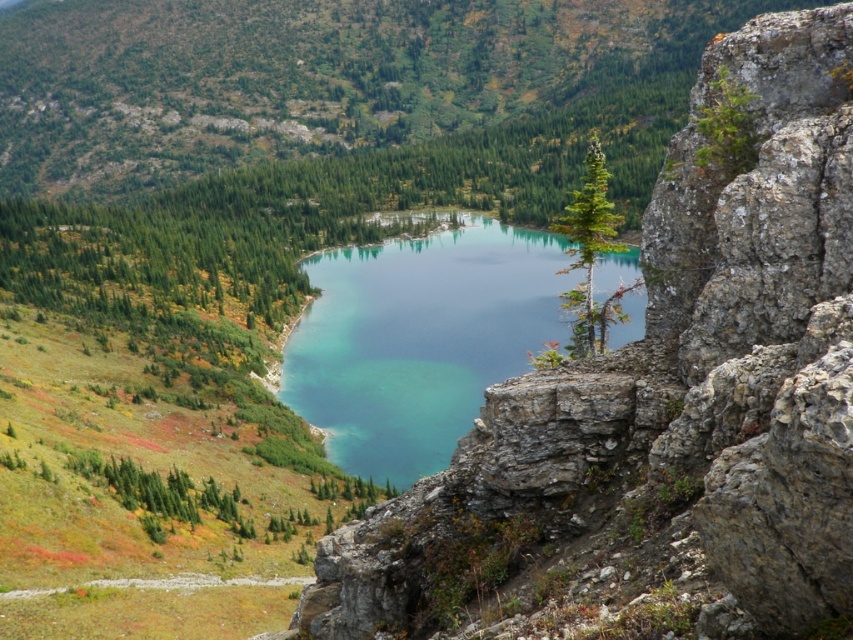
Question: In this image, where is rocky cliff at center located relative to green matte tree at center?

Choices:
 (A) right
 (B) left

Answer: (B)

Question: Can you confirm if rocky cliff at center is thinner than teal glassy water at center?

Choices:
 (A) yes
 (B) no

Answer: (A)

Question: Which object is positioned closest to the teal glassy water at center?

Choices:
 (A) rocky cliff at center
 (B) green matte tree at center

Answer: (B)

Question: Among these points, which one is nearest to the camera?

Choices:
 (A) (602, 349)
 (B) (439, 464)
 (C) (700, 275)

Answer: (C)

Question: Can you confirm if rocky cliff at center is bigger than teal glassy water at center?

Choices:
 (A) yes
 (B) no

Answer: (B)

Question: Which of the following is the closest to the observer?

Choices:
 (A) (524, 445)
 (B) (352, 275)
 (C) (566, 227)

Answer: (A)